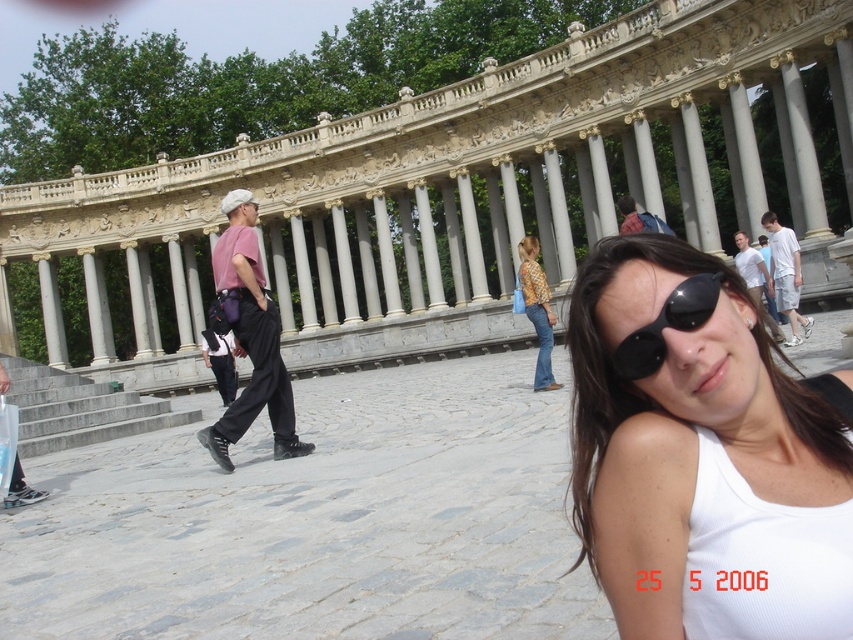
Looking at this image, does white matte tank top at center have a smaller size compared to yellow textured blouse at center?

Incorrect, white matte tank top at center is not smaller in size than yellow textured blouse at center.

Does point (744, 403) lie in front of point (527, 316)?

Yes, point (744, 403) is in front of point (527, 316).

At what (x,y) coordinates should I click in order to perform the action: click on white matte tank top at center. Please return your answer as a coordinate pair (x, y). Looking at the image, I should click on (677, 420).

Is point (627, 353) positioned behind point (538, 323)?

No.

Does black reflective sunglasses at center have a greater width compared to yellow textured blouse at center?

Yes.

In the scene shown: Who is more forward, (647, 372) or (544, 291)?

Point (647, 372) is more forward.

Where is `black reflective sunglasses at center`? The height and width of the screenshot is (640, 853). black reflective sunglasses at center is located at coordinates (666, 326).

Between white matte tank top at center and black reflective sunglasses at center, which one has less height?

With less height is black reflective sunglasses at center.

Who is more distant from viewer, (744, 392) or (654, 339)?

Positioned behind is point (654, 339).

Locate an element on the screen. Image resolution: width=853 pixels, height=640 pixels. white matte tank top at center is located at coordinates (677, 420).